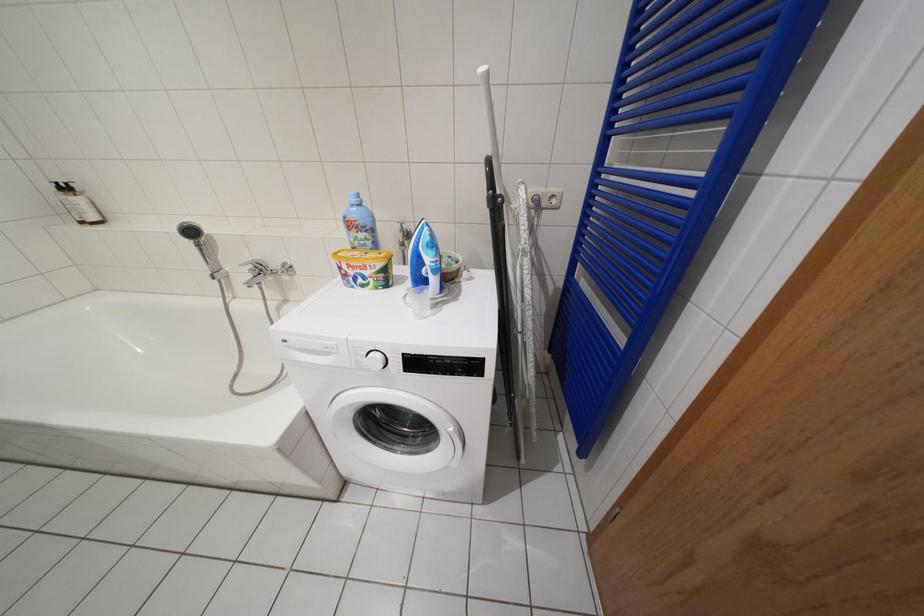
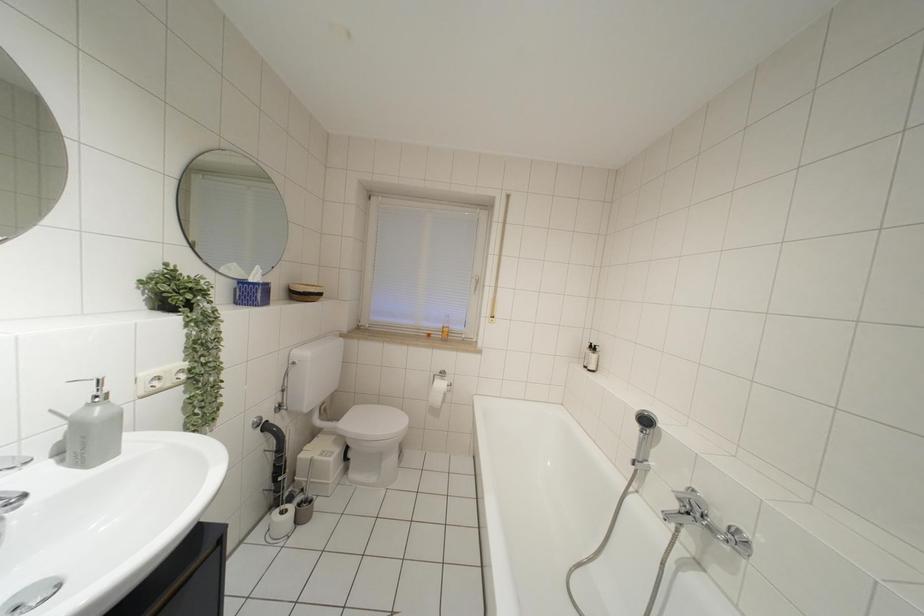
Question: Based on the continuous images, in which direction is the camera rotating? Reply with the corresponding letter.

Choices:
 (A) Left
 (B) Right
 (C) Up
 (D) Down

Answer: (A)